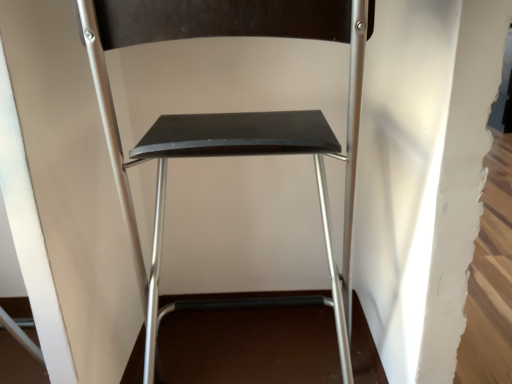
Locate an element on the screen. This screenshot has height=384, width=512. matte black chair at center is located at coordinates (231, 126).

What do you see at coordinates (231, 126) in the screenshot?
I see `matte black chair at center` at bounding box center [231, 126].

Find the location of `matte black chair at center`. matte black chair at center is located at coordinates (231, 126).